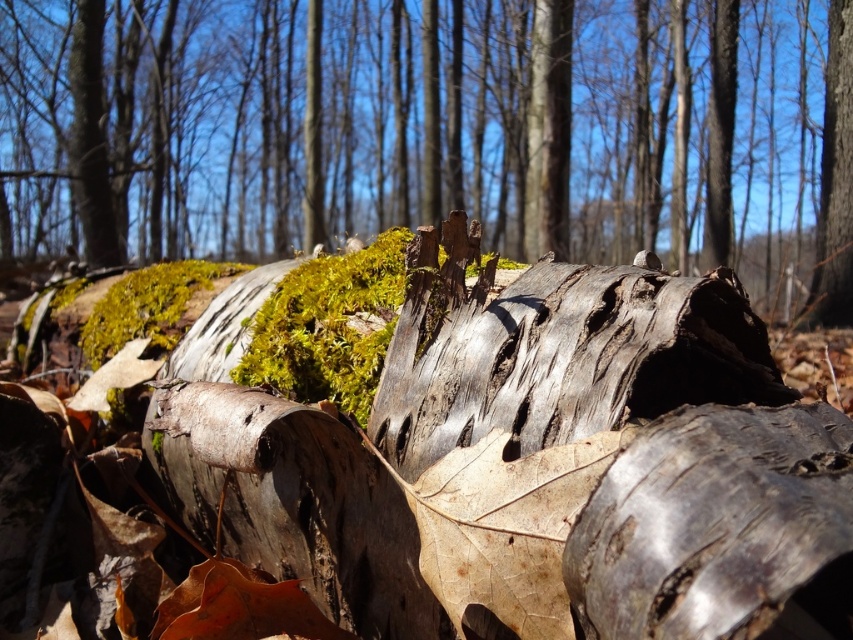
Does smooth bark tree trunk at upper right appear under smooth brown bark at center?

Correct, smooth bark tree trunk at upper right is located below smooth brown bark at center.

Does point (834, 58) come closer to viewer compared to point (85, 202)?

Yes.

Find the location of a particular element. The width and height of the screenshot is (853, 640). smooth bark tree trunk at upper right is located at coordinates click(x=834, y=179).

This screenshot has width=853, height=640. What are the coordinates of `smooth bark tree trunk at upper right` in the screenshot? It's located at (834, 179).

Describe the element at coordinates (428, 129) in the screenshot. The image size is (853, 640). I see `rough bark log at center` at that location.

Which is more to the right, rough bark log at center or smooth brown bark at center?

Positioned to the right is rough bark log at center.

The height and width of the screenshot is (640, 853). I want to click on rough bark log at center, so click(428, 129).

Does rough bark log at center lie behind smooth bark tree trunk at upper right?

That is False.

Who is positioned more to the right, rough bark log at center or smooth bark tree trunk at upper right?

smooth bark tree trunk at upper right

Measure the distance between point (273, 54) and camera.

The distance of point (273, 54) from camera is 16.58 meters.

Locate an element on the screen. The height and width of the screenshot is (640, 853). rough bark log at center is located at coordinates (428, 129).